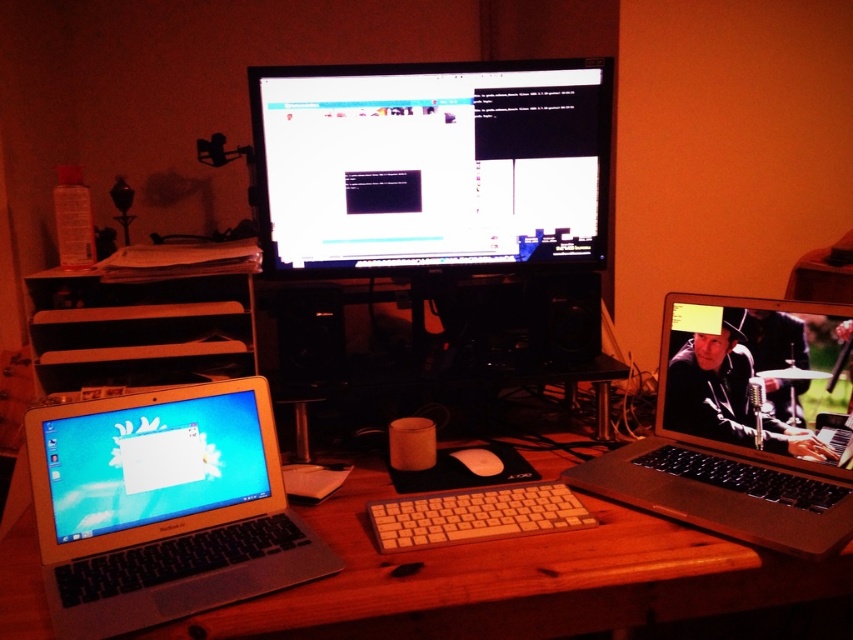
Is point (229, 520) in front of point (802, 388)?

Yes.

Between point (134, 593) and point (722, 384), which one is positioned in front?

Point (134, 593) is more forward.

This screenshot has width=853, height=640. What are the coordinates of `silver metallic laptop at lower left` in the screenshot? It's located at (161, 508).

In the scene shown: Can you confirm if matte black laptop at upper center is wider than white plastic keyboard at center?

No, matte black laptop at upper center is not wider than white plastic keyboard at center.

Can you confirm if matte black laptop at upper center is positioned to the left of white plastic keyboard at center?

No, matte black laptop at upper center is not to the left of white plastic keyboard at center.

Is point (660, 362) in front of point (445, 532)?

That is False.

You are a GUI agent. You are given a task and a screenshot of the screen. Output one action in this format:
    pyautogui.click(x=<x>, y=<y>)
    Task: Click on the matte black laptop at upper center
    
    Given the screenshot: What is the action you would take?
    pyautogui.click(x=758, y=378)

Can you confirm if wooden desk at center is taller than white plastic keyboard at center?

Yes, wooden desk at center is taller than white plastic keyboard at center.

Who is taller, wooden desk at center or white plastic keyboard at center?

wooden desk at center

Is point (442, 577) positioned behind point (384, 538)?

That is False.

Where is `wooden desk at center`? The width and height of the screenshot is (853, 640). wooden desk at center is located at coordinates (515, 580).